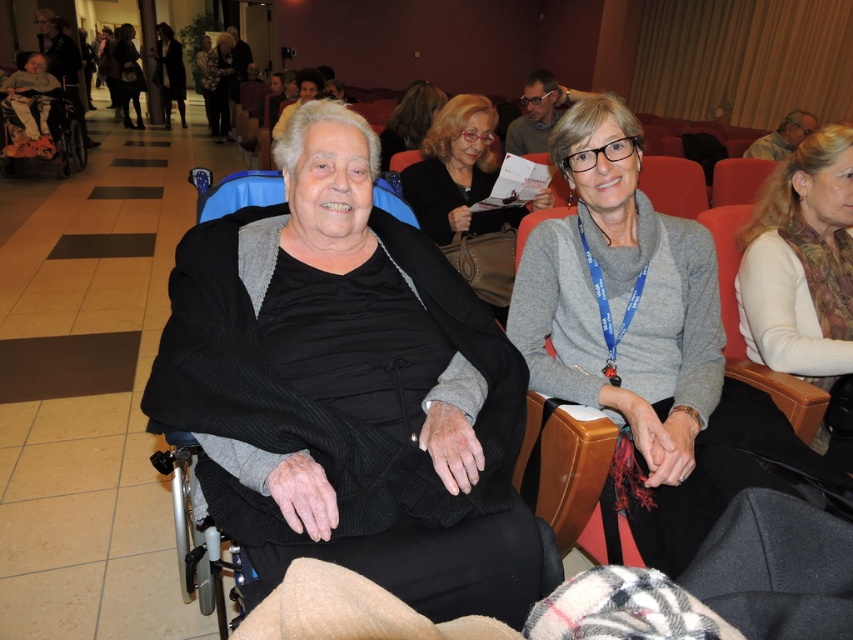
Does black knit sweater at center come in front of gray wool sweater at center?

That is True.

Which is in front, point (506, 392) or point (614, 120)?

Point (506, 392) is more forward.

Who is more forward, (166, 353) or (589, 280)?

Point (166, 353)

You are a GUI agent. You are given a task and a screenshot of the screen. Output one action in this format:
    pyautogui.click(x=<x>, y=<y>)
    Task: Click on the black knit sweater at center
    The height and width of the screenshot is (640, 853).
    Given the screenshot: What is the action you would take?
    pyautogui.click(x=349, y=388)

Image resolution: width=853 pixels, height=640 pixels. In order to click on black knit sweater at center in this screenshot , I will do `click(349, 388)`.

Which is in front, point (230, 333) or point (766, 208)?

Positioned in front is point (230, 333).

I want to click on black knit sweater at center, so click(349, 388).

Between point (454, 99) and point (175, 70), which one is positioned behind?

Positioned behind is point (175, 70).

Does matte black sweater at center have a greater height compared to black fabric dress at upper left?

In fact, matte black sweater at center may be shorter than black fabric dress at upper left.

The width and height of the screenshot is (853, 640). I want to click on matte black sweater at center, so click(x=456, y=172).

Where is `matte black sweater at center`? matte black sweater at center is located at coordinates (456, 172).